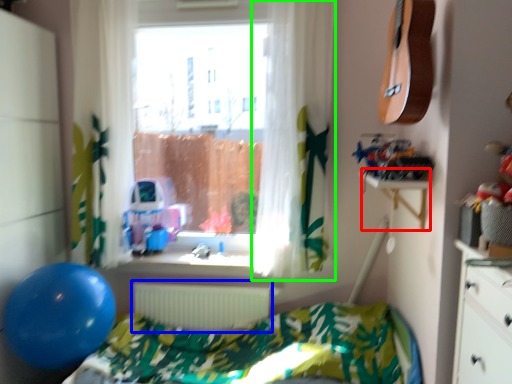
Question: Which is nearer to the table (highlighted by a red box)? radiator (highlighted by a blue box) or curtain (highlighted by a green box).

Choices:
 (A) radiator
 (B) curtain

Answer: (B)